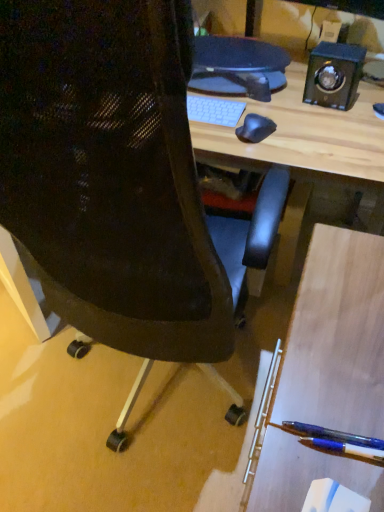
This screenshot has width=384, height=512. Describe the element at coordinates (333, 435) in the screenshot. I see `translucent blue pen at lower right` at that location.

Describe the element at coordinates (119, 181) in the screenshot. I see `black mesh chair at center` at that location.

Identify the location of translucent blue pen at lower right. (333, 435).

Is translucent blue pen at lower right completely or partially inside black polished wood speaker at upper right?

That's incorrect, translucent blue pen at lower right is not inside black polished wood speaker at upper right.

From the image's perspective, which one is positioned lower, black polished wood speaker at upper right or translucent blue pen at lower right?

translucent blue pen at lower right is shown below in the image.

Does black polished wood speaker at upper right have a greater width compared to translucent blue pen at lower right?

Incorrect, the width of black polished wood speaker at upper right does not surpass that of translucent blue pen at lower right.

Is black polished wood speaker at upper right not close to translucent blue pen at lower right?

That's right, there is a large distance between black polished wood speaker at upper right and translucent blue pen at lower right.

Which object is wider, black mesh chair at center or blue glossy pen at lower right?

Wider between the two is black mesh chair at center.

Is black mesh chair at center next to blue glossy pen at lower right and touching it?

They are not placed beside each other.

From the image's perspective, between black mesh chair at center and blue glossy pen at lower right, who is located below?

From the image's view, blue glossy pen at lower right is below.

Can you confirm if black mesh chair at center is bigger than blue glossy pen at lower right?

Correct, black mesh chair at center is larger in size than blue glossy pen at lower right.

Are black mesh chair at center and translucent blue pen at lower right located far from each other?

No, black mesh chair at center is in close proximity to translucent blue pen at lower right.

How many degrees apart are the facing directions of black mesh chair at center and translucent blue pen at lower right?

They differ by 93.9 degrees in their facing directions.

Can you confirm if black mesh chair at center is shorter than translucent blue pen at lower right?

No, black mesh chair at center is not shorter than translucent blue pen at lower right.

Which is more to the right, black mesh chair at center or translucent blue pen at lower right?

translucent blue pen at lower right is more to the right.

Does point (311, 434) come farther from viewer compared to point (323, 103)?

No, it is not.

From a real-world perspective, which object rests below the other?

From a 3D spatial view, translucent blue pen at lower right is below.

Is the surface of translucent blue pen at lower right in direct contact with black polished wood speaker at upper right?

There is a gap between translucent blue pen at lower right and black polished wood speaker at upper right.

Between translucent blue pen at lower right and black polished wood speaker at upper right, which one appears on the left side from the viewer's perspective?

From the viewer's perspective, translucent blue pen at lower right appears more on the left side.

Consider the image. Does blue glossy pen at lower right lie behind black polished wood speaker at upper right?

No, it is not.

Is blue glossy pen at lower right aimed at black polished wood speaker at upper right?

No, blue glossy pen at lower right is not facing towards black polished wood speaker at upper right.

Which is behind, point (334, 449) or point (321, 92)?

The point (321, 92) is behind.

Which of these two, blue glossy pen at lower right or black polished wood speaker at upper right, is bigger?

With larger size is black polished wood speaker at upper right.

From a real-world perspective, between blue glossy pen at lower right and black mesh chair at center, who is vertically lower?

From a 3D spatial view, black mesh chair at center is below.

From the picture: Visually, is blue glossy pen at lower right positioned to the left or to the right of black mesh chair at center?

From the image, it's evident that blue glossy pen at lower right is to the right of black mesh chair at center.

Looking at their sizes, would you say blue glossy pen at lower right is wider or thinner than black mesh chair at center?

Clearly, blue glossy pen at lower right has less width compared to black mesh chair at center.

From the image's perspective, which is below, translucent blue pen at lower right or blue glossy pen at lower right?

blue glossy pen at lower right appears lower in the image.

Identify the location of pencil on the right of translucent blue pen at lower right. (344, 448).

Which object is positioned more to the right, translucent blue pen at lower right or blue glossy pen at lower right?

From the viewer's perspective, blue glossy pen at lower right appears more on the right side.

Between point (306, 432) and point (383, 452), which one is positioned in front?

Point (383, 452)

Find the location of a particular element. penguin in front of the black polished wood speaker at upper right is located at coordinates (333, 435).

Find the location of a particular element. pencil located below the black mesh chair at center (from the image's perspective) is located at coordinates (344, 448).

Based on their spatial positions, is blue glossy pen at lower right or black mesh chair at center further from translucent blue pen at lower right?

black mesh chair at center is further to translucent blue pen at lower right.

Which object lies further to the anchor point black polished wood speaker at upper right, black mesh chair at center or blue glossy pen at lower right?

blue glossy pen at lower right lies further to black polished wood speaker at upper right than the other object.

From the image, which object appears to be farther from black mesh chair at center, translucent blue pen at lower right or blue glossy pen at lower right?

blue glossy pen at lower right lies further to black mesh chair at center than the other object.

When comparing their distances from blue glossy pen at lower right, does black polished wood speaker at upper right or black mesh chair at center seem further?

Based on the image, black polished wood speaker at upper right appears to be further to blue glossy pen at lower right.

Which object lies further to the anchor point black polished wood speaker at upper right, blue glossy pen at lower right or translucent blue pen at lower right?

blue glossy pen at lower right.

Looking at this image, estimate the real-world distances between objects in this image. Which object is closer to black mesh chair at center, blue glossy pen at lower right or translucent blue pen at lower right?

translucent blue pen at lower right is positioned closer to the anchor black mesh chair at center.

Which object lies nearer to the anchor point blue glossy pen at lower right, black polished wood speaker at upper right or translucent blue pen at lower right?

translucent blue pen at lower right is closer to blue glossy pen at lower right.

Which object lies nearer to the anchor point blue glossy pen at lower right, black mesh chair at center or black polished wood speaker at upper right?

black mesh chair at center lies closer to blue glossy pen at lower right than the other object.

You are a GUI agent. You are given a task and a screenshot of the screen. Output one action in this format:
    pyautogui.click(x=<x>, y=<y>)
    Task: Click on the penguin between black mesh chair at center and blue glossy pen at lower right from left to right
    
    Given the screenshot: What is the action you would take?
    pyautogui.click(x=333, y=435)

Image resolution: width=384 pixels, height=512 pixels. Identify the location of penguin between black polished wood speaker at upper right and blue glossy pen at lower right in the up-down direction. (333, 435).

What are the coordinates of `pencil between black mesh chair at center and black polished wood speaker at upper right from front to back` in the screenshot? It's located at (344, 448).

Where is `penguin located between black mesh chair at center and black polished wood speaker at upper right in the depth direction`? This screenshot has height=512, width=384. penguin located between black mesh chair at center and black polished wood speaker at upper right in the depth direction is located at coordinates (333, 435).